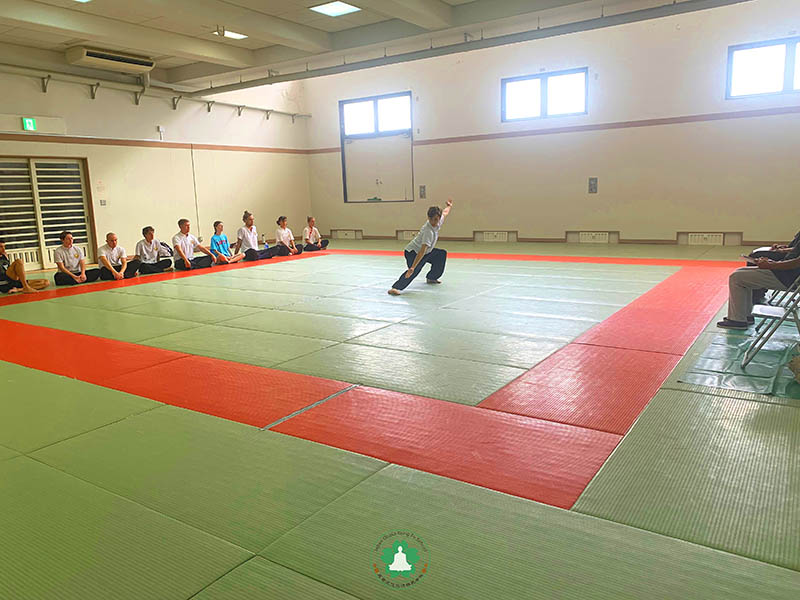
Find the location of a particular element. The height and width of the screenshot is (600, 800). ceiling is located at coordinates (174, 22).